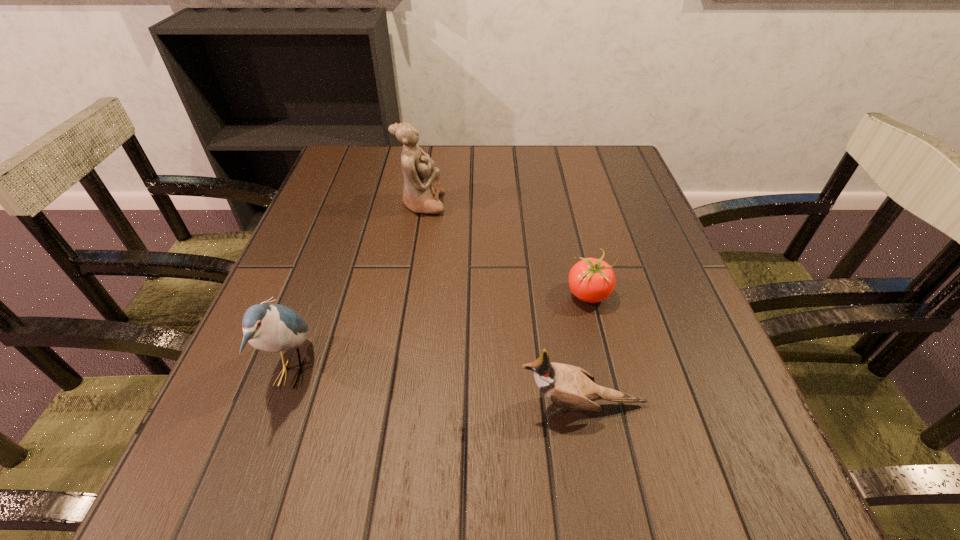
You are a GUI agent. You are given a task and a screenshot of the screen. Output one action in this format:
    pyautogui.click(x=<x>, y=<y>)
    Task: Click on the free space between the shortest object and the third shortest object
    
    Given the screenshot: What is the action you would take?
    pyautogui.click(x=441, y=334)

This screenshot has width=960, height=540. What are the coordinates of `vacant space that is in between the leftmost object and the tomato` in the screenshot? It's located at pyautogui.click(x=441, y=334).

Where is `free space between the tallest object and the right bird`? This screenshot has height=540, width=960. free space between the tallest object and the right bird is located at coordinates (502, 304).

At what (x,y) coordinates should I click in order to perform the action: click on free spot between the right bird and the tomato. Please return your answer as a coordinate pair (x, y). This screenshot has height=540, width=960. Looking at the image, I should click on (586, 349).

This screenshot has height=540, width=960. Find the location of `vacant space that is in between the tomato and the right bird`. vacant space that is in between the tomato and the right bird is located at coordinates (586, 349).

The width and height of the screenshot is (960, 540). I want to click on vacant area between the tallest object and the third tallest object, so click(502, 304).

Select which object is the third closest to the left bird. Please provide its 2D coordinates. Your answer should be formatted as a tuple, i.e. [(x, y)], where the tuple contains the x and y coordinates of a point satisfying the conditions above.

[(591, 280)]

Find the location of a particular element. The height and width of the screenshot is (540, 960). the third closest object to the leftmost object is located at coordinates (591, 280).

This screenshot has width=960, height=540. I want to click on blank space that satisfies the following two spatial constraints: 1. on the front side of the shortest object; 2. at the tip of the left bird's beak, so click(609, 373).

You are a GUI agent. You are given a task and a screenshot of the screen. Output one action in this format:
    pyautogui.click(x=<x>, y=<y>)
    Task: Click on the vacant space that satisfies the following two spatial constraints: 1. on the front-facing side of the tallest object; 2. on the right side of the tomato
    The image size is (960, 540).
    Given the screenshot: What is the action you would take?
    pyautogui.click(x=407, y=294)